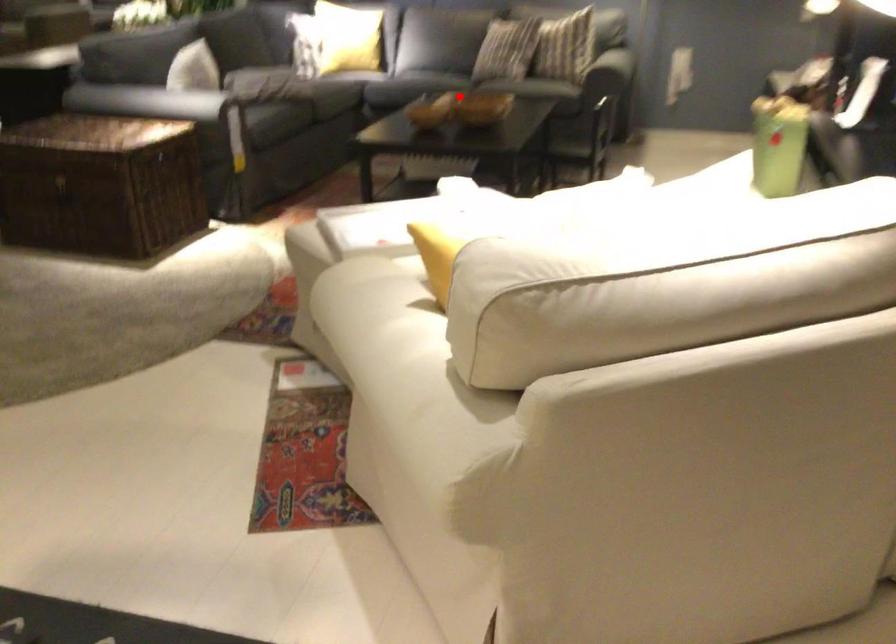
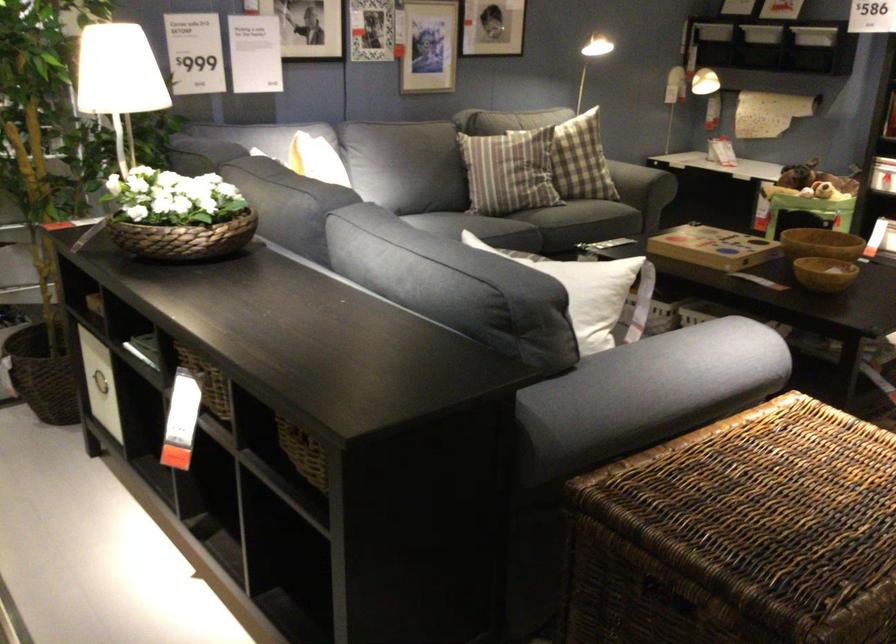
In the second image, find the point that corresponds to the highlighted location in the first image.

(821, 243)